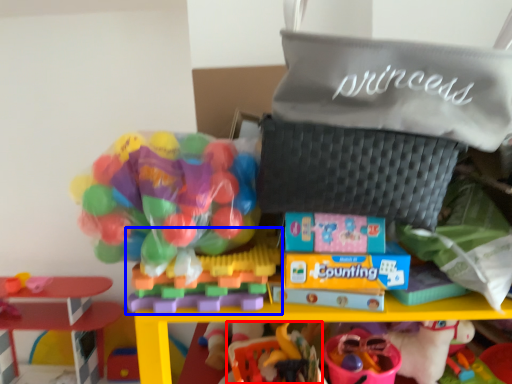
Question: Among these objects, which one is farthest to the camera, toy (highlighted by a red box) or toy (highlighted by a blue box)?

Choices:
 (A) toy
 (B) toy

Answer: (A)